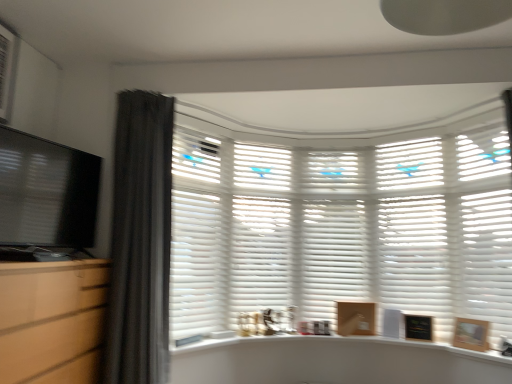
I want to click on vacant space in front of black matte picture frame at lower right, which is the second picture frame from front to back, so click(x=432, y=343).